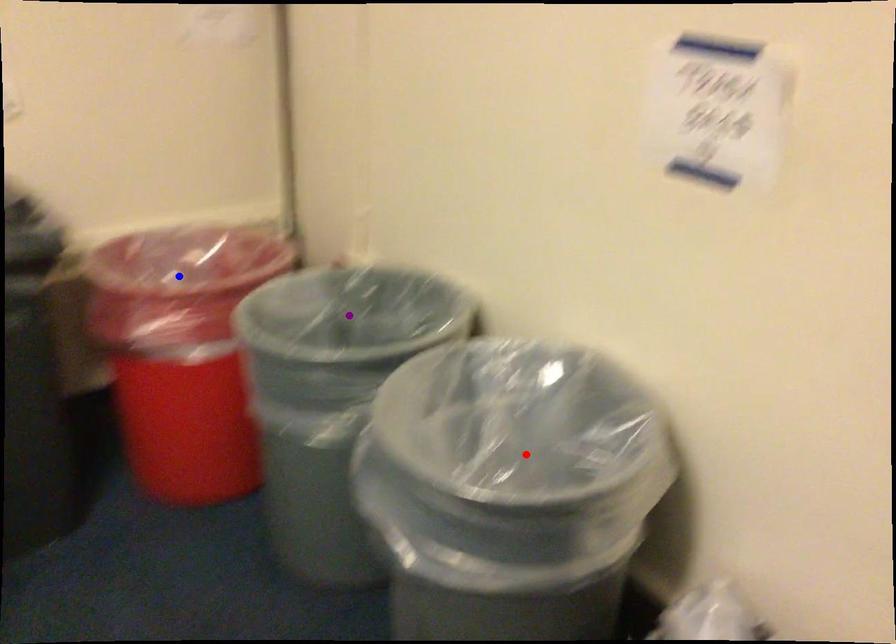
Order these from nearest to farthest:
red point
blue point
purple point

red point → purple point → blue point